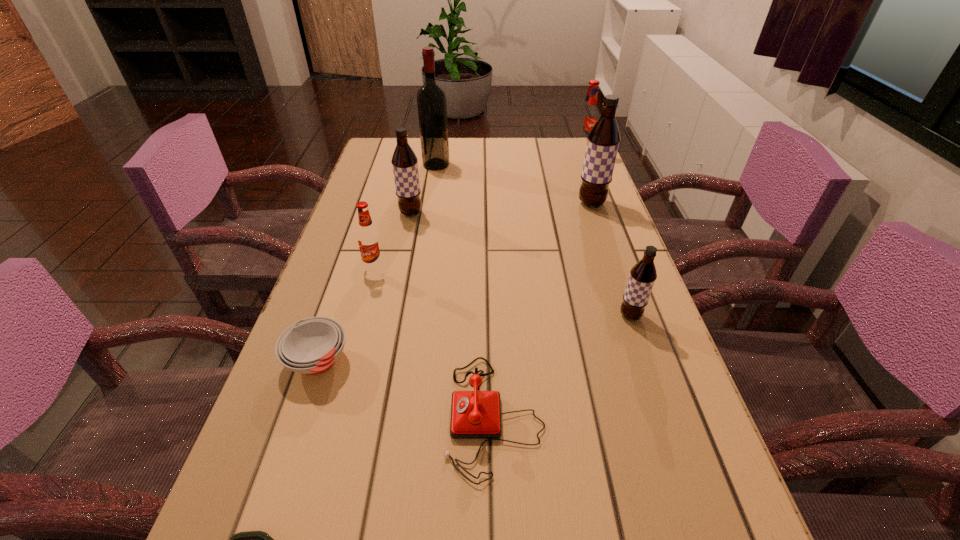
Identify the location of green alcohol. This screenshot has width=960, height=540. (431, 99).

Locate an element on the screen. This screenshot has width=960, height=540. the tallest root beer is located at coordinates (603, 140).

The image size is (960, 540). What are the coordinates of `the biggest brown root beer` in the screenshot? It's located at (603, 140).

Identify the location of the farthest root beer. (588, 116).

Where is `the right red root beer`? The image size is (960, 540). the right red root beer is located at coordinates (588, 116).

Locate an element on the screen. The height and width of the screenshot is (540, 960). the leftmost brown root beer is located at coordinates (404, 161).

Find the location of a particular element. The image size is (960, 540). the fifth farthest object is located at coordinates (368, 237).

This screenshot has height=540, width=960. What are the coordinates of `the nearer red root beer` in the screenshot? It's located at (368, 237).

In order to click on the smallest brown root beer in this screenshot , I will do `click(643, 274)`.

Find the location of a particular element. This screenshot has width=960, height=540. the nearest brown root beer is located at coordinates (643, 274).